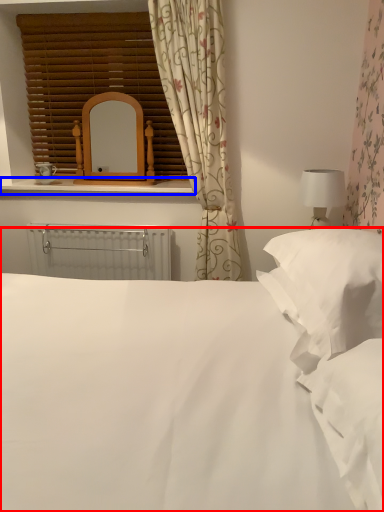
Question: Which object is further to the camera taking this photo, bed (highlighted by a red box) or window sill (highlighted by a blue box)?

Choices:
 (A) bed
 (B) window sill

Answer: (B)